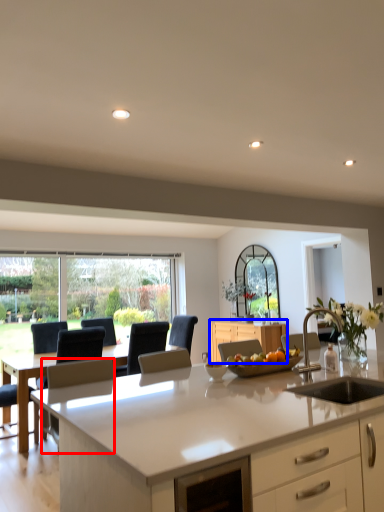
Question: Which object appears closest to the camera in this image, armchair (highlighted by a red box) or cabinetry (highlighted by a blue box)?

Choices:
 (A) armchair
 (B) cabinetry

Answer: (A)